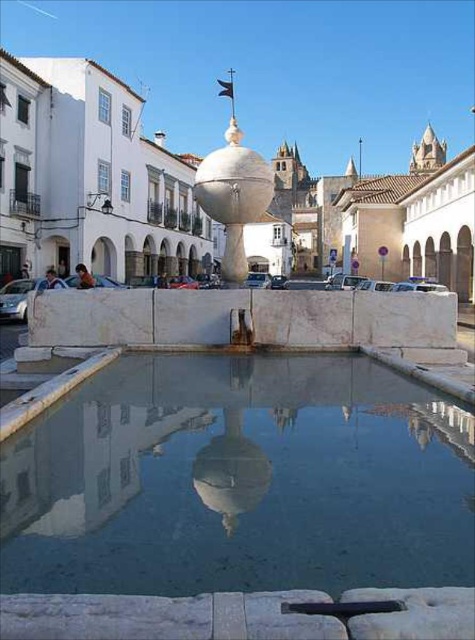
Does point (254, 461) come behind point (243, 280)?

No.

Is point (68, 483) farther from camera compared to point (268, 202)?

No, (68, 483) is closer to viewer.

The height and width of the screenshot is (640, 475). Identify the location of clear glass water at center. (238, 481).